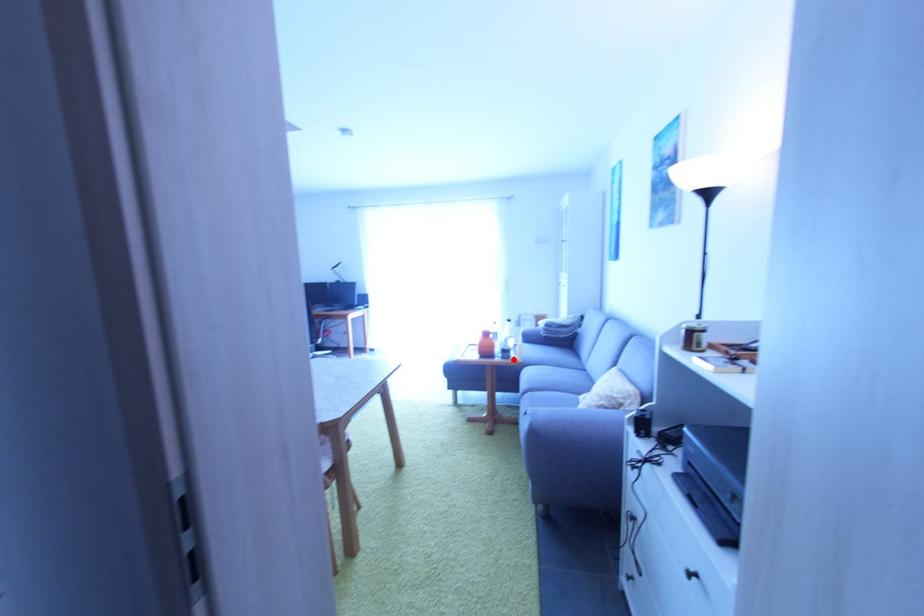
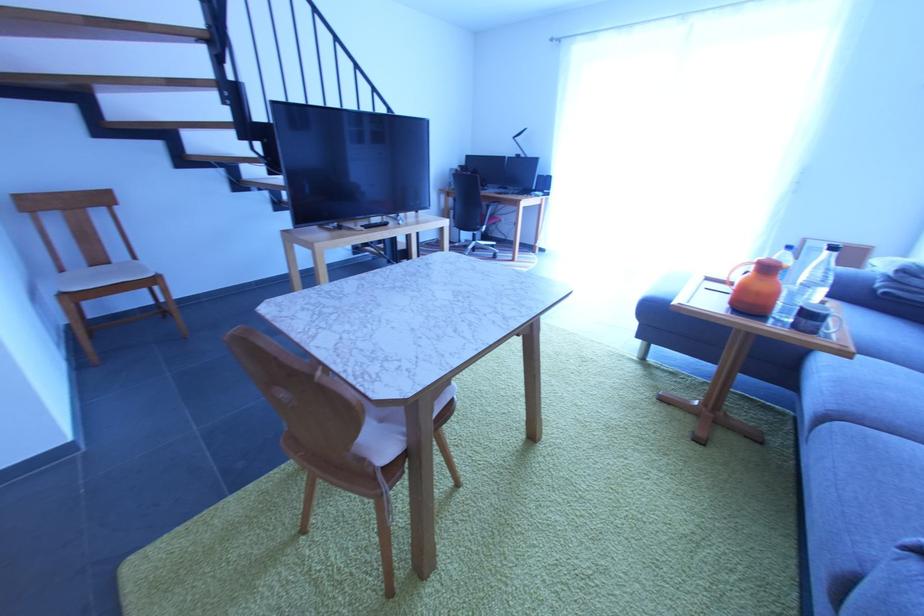
Question: A red point is marked in image1. In image2, is the corresponding 3D point closer to the camera or farther? Reply with the corresponding letter.

Choices:
 (A) The corresponding 3D point is closer.
 (B) The corresponding 3D point is farther.

Answer: (A)